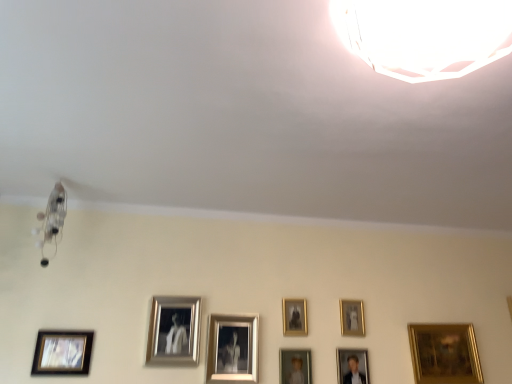
Question: Is silver metallic picture frame at center, which is the seventh picture frame in right-to-left order, further to camera compared to gold metallic picture frame at upper right, the seventh picture frame positioned from the left?

Choices:
 (A) no
 (B) yes

Answer: (A)

Question: Is silver metallic picture frame at center, positioned as the 2th picture frame in left-to-right order, to the left of gold metallic picture frame at upper right, the seventh picture frame positioned from the left, from the viewer's perspective?

Choices:
 (A) yes
 (B) no

Answer: (A)

Question: Does silver metallic picture frame at center, which is the seventh picture frame in right-to-left order, have a greater width compared to gold metallic picture frame at upper right, the seventh picture frame positioned from the left?

Choices:
 (A) no
 (B) yes

Answer: (B)

Question: Is there a large distance between silver metallic picture frame at center, positioned as the 2th picture frame in left-to-right order, and gold metallic picture frame at upper right, acting as the second picture frame starting from the right?

Choices:
 (A) no
 (B) yes

Answer: (A)

Question: Is the position of silver metallic picture frame at center, positioned as the 2th picture frame in left-to-right order, less distant than that of gold metallic picture frame at upper right, acting as the second picture frame starting from the right?

Choices:
 (A) no
 (B) yes

Answer: (B)

Question: Is point (32, 231) positioned closer to the camera than point (474, 337)?

Choices:
 (A) closer
 (B) farther

Answer: (A)

Question: Is metallic glass chandelier at upper left, which ranks as the second lamp in front-to-back order, inside the boundaries of gold metallic picture frame at lower right, which is counted as the 1th picture frame, starting from the right, or outside?

Choices:
 (A) inside
 (B) outside

Answer: (B)

Question: Considering the positions of metallic glass chandelier at upper left, positioned as the first lamp in left-to-right order, and gold metallic picture frame at lower right, which is counted as the 1th picture frame, starting from the right, in the image, is metallic glass chandelier at upper left, positioned as the first lamp in left-to-right order, wider or thinner than gold metallic picture frame at lower right, which is counted as the 1th picture frame, starting from the right,?

Choices:
 (A) thin
 (B) wide

Answer: (B)

Question: Based on their positions, is metallic glass chandelier at upper left, which is the 2th lamp from right to left, located to the left or right of gold metallic picture frame at lower right, positioned as the eighth picture frame in left-to-right order?

Choices:
 (A) left
 (B) right

Answer: (A)

Question: Do you think gold metallic picture frame at upper right, acting as the second picture frame starting from the right, is within gold metallic picture frame at lower right, which is counted as the 1th picture frame, starting from the right, or outside of it?

Choices:
 (A) inside
 (B) outside

Answer: (B)

Question: From the image's perspective, relative to gold metallic picture frame at lower right, which is counted as the 1th picture frame, starting from the right, is gold metallic picture frame at upper right, acting as the second picture frame starting from the right, above or below?

Choices:
 (A) below
 (B) above

Answer: (B)

Question: In terms of height, does gold metallic picture frame at upper right, the seventh picture frame positioned from the left, look taller or shorter compared to gold metallic picture frame at lower right, positioned as the eighth picture frame in left-to-right order?

Choices:
 (A) short
 (B) tall

Answer: (A)

Question: Looking at the image, does gold metallic picture frame at upper right, acting as the second picture frame starting from the right, seem bigger or smaller compared to gold metallic picture frame at lower right, which is counted as the 1th picture frame, starting from the right?

Choices:
 (A) big
 (B) small

Answer: (B)

Question: Is gold metallic picture frame at lower right, which is counted as the 1th picture frame, starting from the right, wider or thinner than gold metallic picture frame at upper center, which ranks as the fourth picture frame in right-to-left order?

Choices:
 (A) thin
 (B) wide

Answer: (B)

Question: Considering the positions of point (451, 370) and point (286, 334), is point (451, 370) closer or farther from the camera than point (286, 334)?

Choices:
 (A) farther
 (B) closer

Answer: (A)